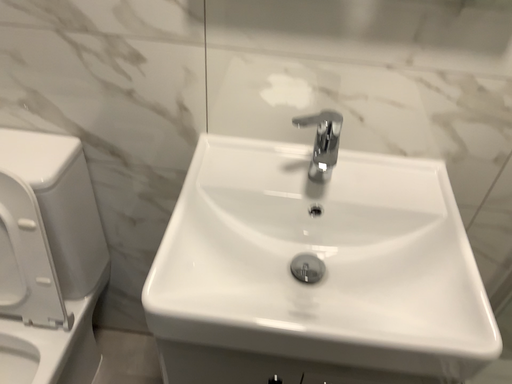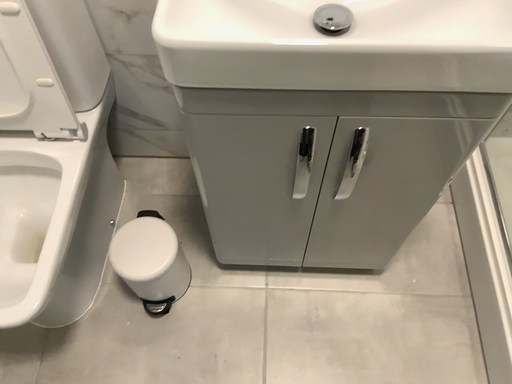
Question: Which way did the camera rotate in the video?

Choices:
 (A) rotated downward
 (B) rotated upward

Answer: (A)